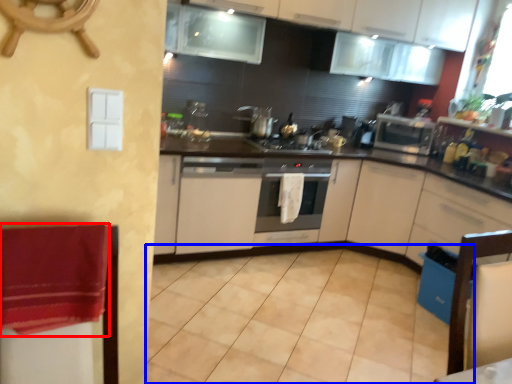
Question: Which point is closer to the camera, blanket (highlighted by a red box) or tile (highlighted by a blue box)?

Choices:
 (A) blanket
 (B) tile

Answer: (A)